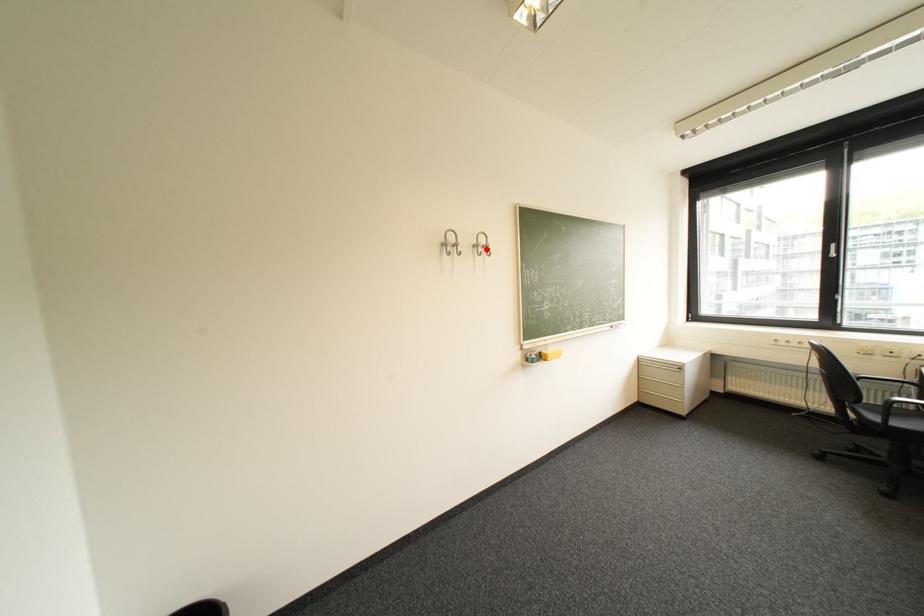
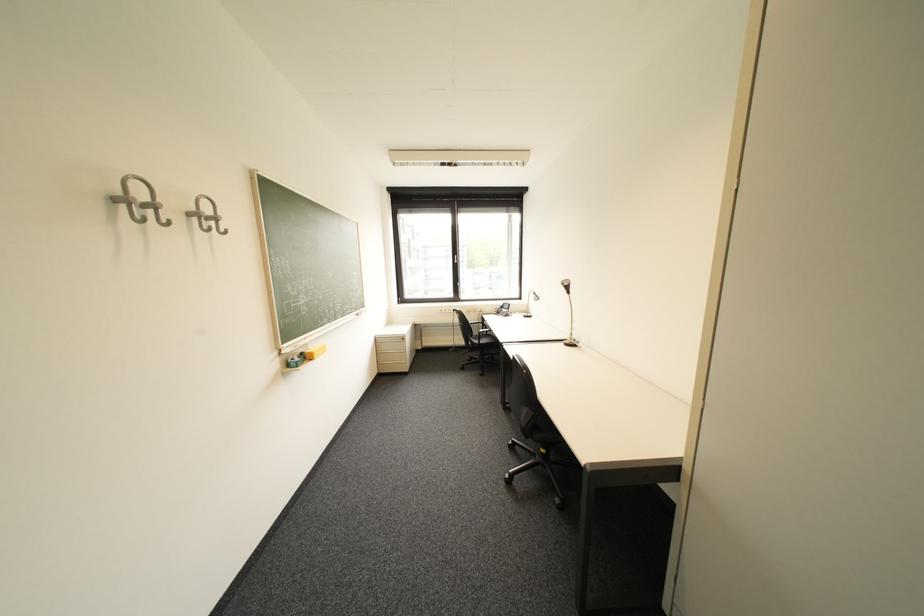
Where in the second image is the point corresponding to the highlighted location from the first image?

(205, 220)